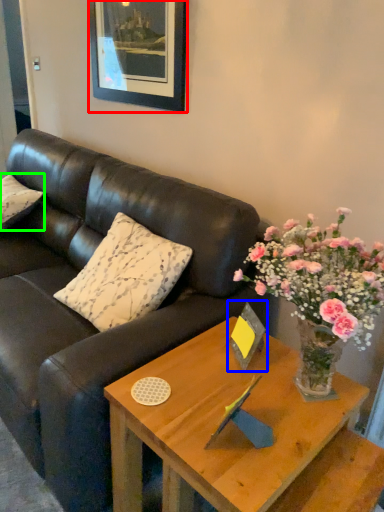
Question: Which object is positioned farthest from picture frame (highlighted by a red box)? Select from picture frame (highlighted by a blue box) and pillow (highlighted by a green box).

Choices:
 (A) picture frame
 (B) pillow

Answer: (A)